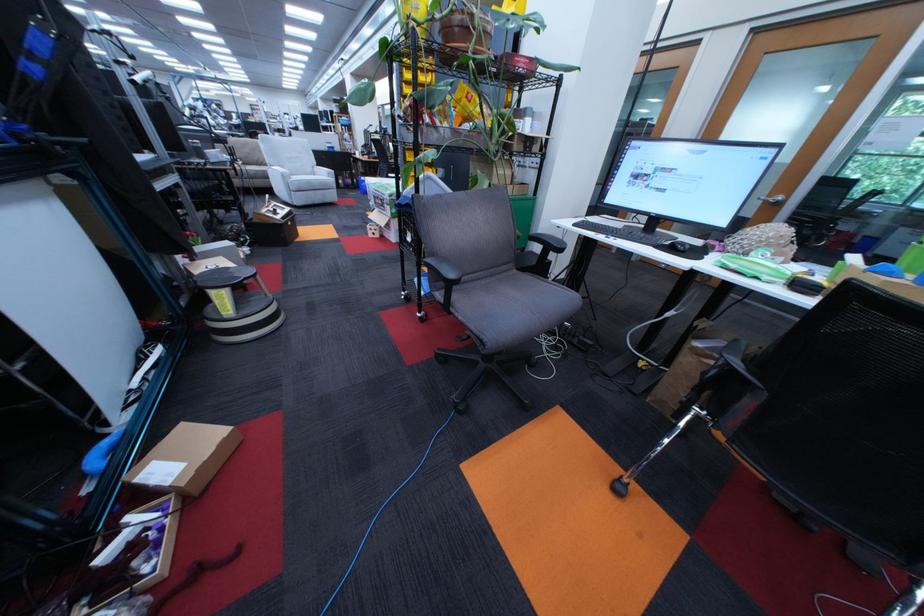
Where is `black computer keyboard`? This screenshot has width=924, height=616. black computer keyboard is located at coordinates (629, 233).